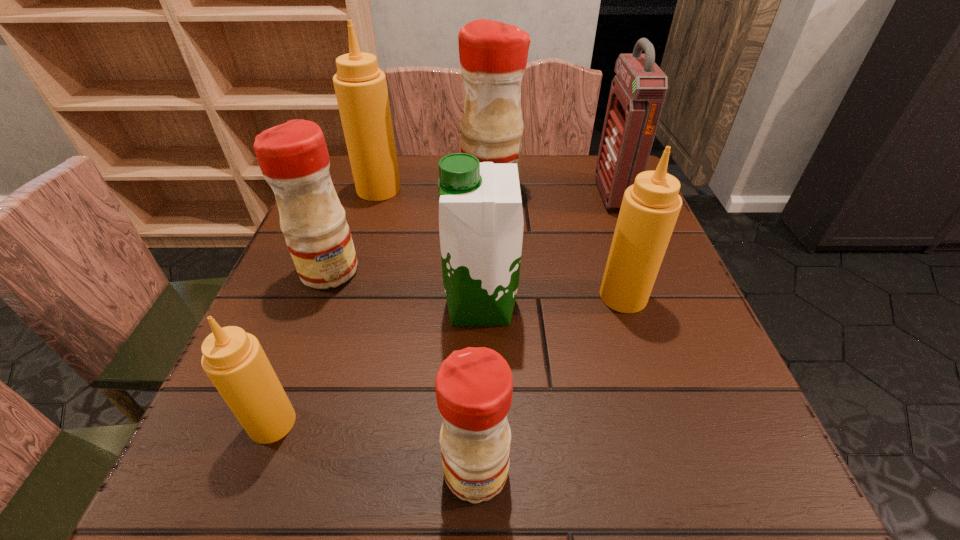
You are a GUI agent. You are given a task and a screenshot of the screen. Output one action in this format:
    pyautogui.click(x=<x>, y=<y>)
    Task: Click on the free space located 0.060m on the back of the farthest tan condiment
    The height and width of the screenshot is (540, 960).
    Given the screenshot: What is the action you would take?
    point(386,166)

This screenshot has height=540, width=960. Find the location of `vacant space located 0.340m on the front of the biggest red condiment`. vacant space located 0.340m on the front of the biggest red condiment is located at coordinates (495, 310).

Where is `free space located 0.110m on the front-facing side of the red first-aid kit`? free space located 0.110m on the front-facing side of the red first-aid kit is located at coordinates (555, 194).

Locate an element on the screen. Image resolution: width=960 pixels, height=540 pixels. free region located 0.160m on the front-facing side of the red first-aid kit is located at coordinates (534, 194).

At what (x,y) coordinates should I click in order to perform the action: click on free spot located 0.060m on the front-facing side of the red first-aid kit. Please return your answer as a coordinate pair (x, y). Looking at the image, I should click on (575, 194).

This screenshot has height=540, width=960. I want to click on free point located on the left of the rightmost condiment, so click(x=439, y=296).

I want to click on vacant region located 0.300m on the back of the second smallest red condiment, so (x=364, y=178).

The width and height of the screenshot is (960, 540). I want to click on vacant space located 0.240m on the front-facing side of the green soya milk, so click(314, 305).

Identify the location of free space located 0.130m on the front-facing side of the green soya milk. This screenshot has width=960, height=540. (373, 305).

You are a GUI agent. You are given a task and a screenshot of the screen. Output one action in this format:
    pyautogui.click(x=<x>, y=<y>)
    Task: Click on the vacant region located 0.180m on the front-facing side of the green soya milk
    
    Given the screenshot: What is the action you would take?
    pyautogui.click(x=347, y=305)